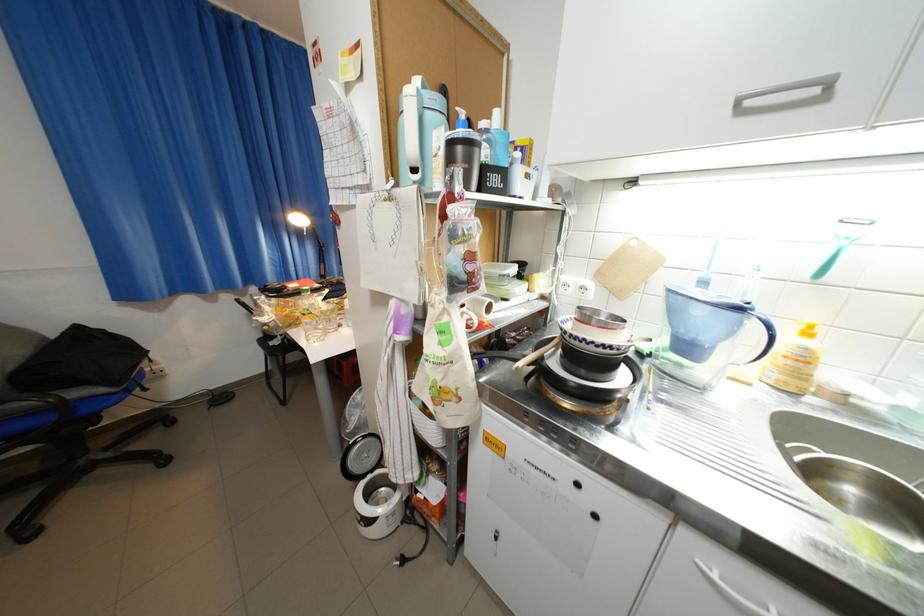
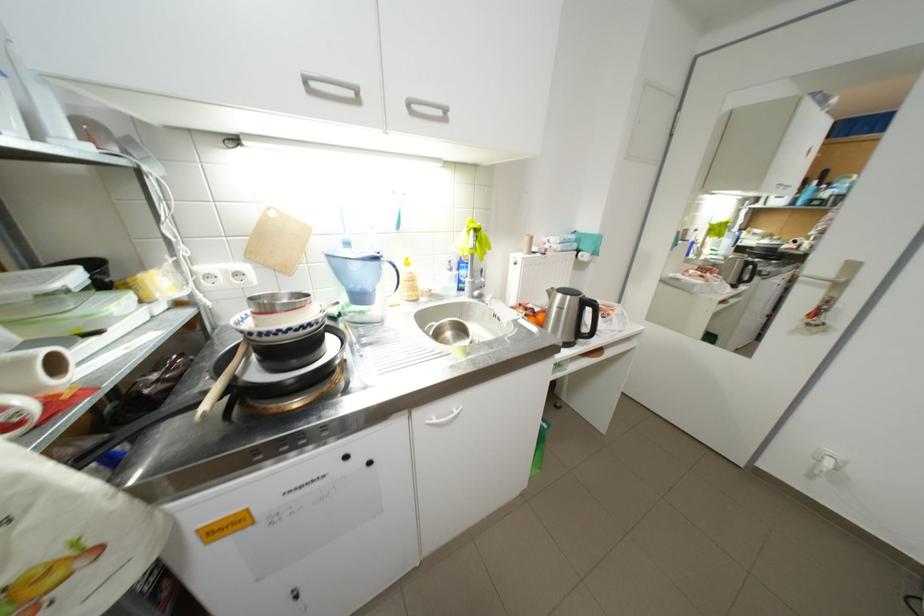
Based on the continuous images, in which direction is the camera rotating?

The camera's rotation is toward right-down.